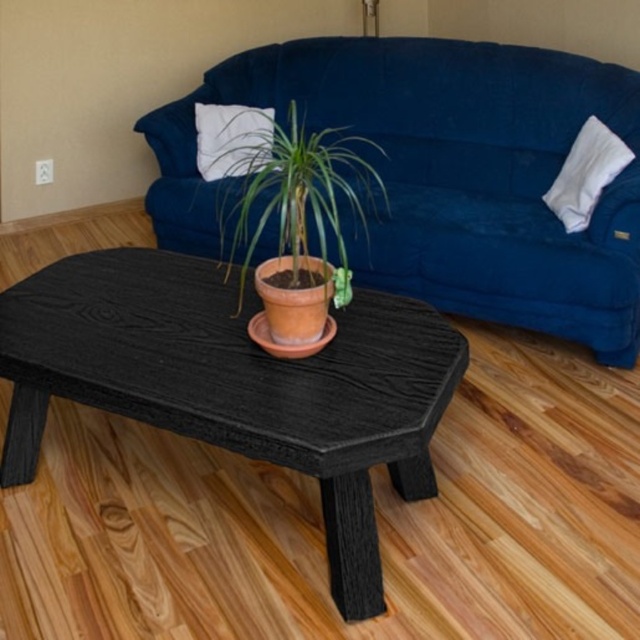
Question: Is terracotta clay pot at center to the right of white cotton pillow at upper left from the viewer's perspective?

Choices:
 (A) yes
 (B) no

Answer: (A)

Question: Which object is positioned closest to the white cotton pillow at upper left?

Choices:
 (A) black wood table at center
 (B) terracotta clay pot at center
 (C) white cotton pillow at upper right
 (D) velvet blue couch at center

Answer: (B)

Question: Can you confirm if velvet blue couch at center is positioned to the left of white cotton pillow at upper right?

Choices:
 (A) no
 (B) yes

Answer: (B)

Question: Is black wood table at center closer to camera compared to white cotton pillow at upper left?

Choices:
 (A) yes
 (B) no

Answer: (A)

Question: Which of these objects is positioned farthest from the black wood table at center?

Choices:
 (A) white cotton pillow at upper left
 (B) white cotton pillow at upper right
 (C) velvet blue couch at center

Answer: (B)

Question: Estimate the real-world distances between objects in this image. Which object is closer to the black wood table at center?

Choices:
 (A) terracotta clay pot at center
 (B) white cotton pillow at upper left

Answer: (A)